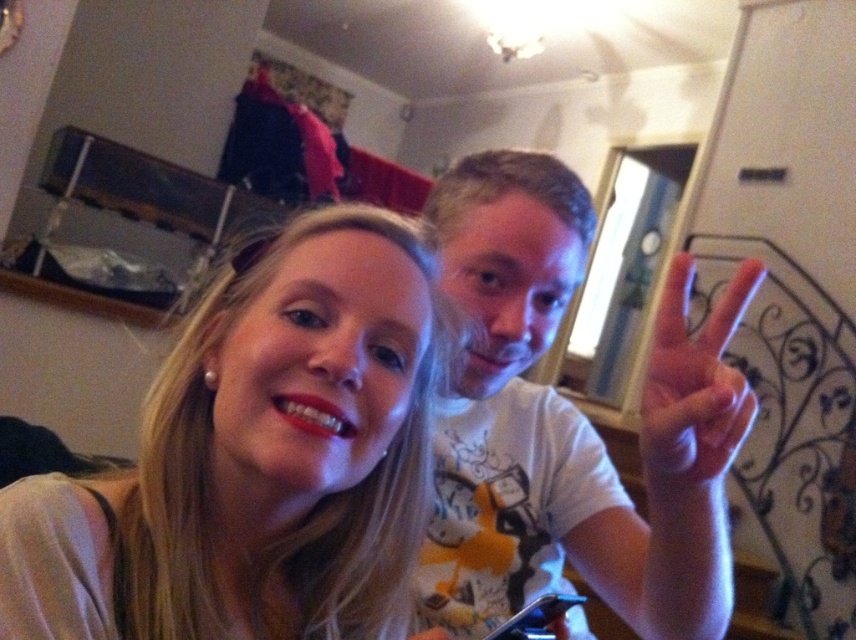
In the image, there is a point at coordinates (257, 458). What object is located at this point?

The point at coordinates (257, 458) indicates the smooth beige shirt at center.